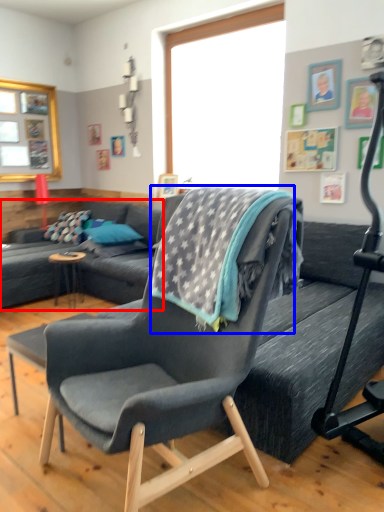
Question: Which object is further to the camera taking this photo, studio couch (highlighted by a red box) or blanket (highlighted by a blue box)?

Choices:
 (A) studio couch
 (B) blanket

Answer: (A)